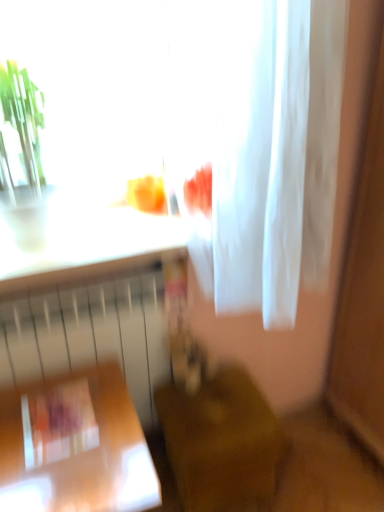
Question: Is white sheer fabric at upper center located within white matte radiator at lower left?

Choices:
 (A) yes
 (B) no

Answer: (B)

Question: Is white matte radiator at lower left shorter than white sheer fabric at upper center?

Choices:
 (A) no
 (B) yes

Answer: (A)

Question: Is white matte radiator at lower left at the left side of white sheer fabric at upper center?

Choices:
 (A) no
 (B) yes

Answer: (B)

Question: Is the depth of white matte radiator at lower left less than that of white sheer fabric at upper center?

Choices:
 (A) no
 (B) yes

Answer: (A)

Question: Is white matte radiator at lower left oriented away from white sheer fabric at upper center?

Choices:
 (A) no
 (B) yes

Answer: (A)

Question: Does white matte radiator at lower left have a greater height compared to white sheer fabric at upper center?

Choices:
 (A) no
 (B) yes

Answer: (B)

Question: Could you tell me if wooden chair at lower center, which is counted as the 1th furniture, starting from the right, is facing wooden table at lower left, the second furniture viewed from the right?

Choices:
 (A) yes
 (B) no

Answer: (B)

Question: Is wooden chair at lower center, which is the 2th furniture from left to right, not close to wooden table at lower left, positioned as the first furniture in left-to-right order?

Choices:
 (A) yes
 (B) no

Answer: (B)

Question: From the image's perspective, is wooden chair at lower center, which is the 2th furniture from left to right, on top of wooden table at lower left, positioned as the first furniture in left-to-right order?

Choices:
 (A) no
 (B) yes

Answer: (B)

Question: Considering the relative sizes of wooden chair at lower center, which is the 2th furniture from left to right, and wooden table at lower left, the second furniture viewed from the right, in the image provided, is wooden chair at lower center, which is the 2th furniture from left to right, shorter than wooden table at lower left, the second furniture viewed from the right,?

Choices:
 (A) yes
 (B) no

Answer: (A)

Question: Does wooden chair at lower center, which is the 2th furniture from left to right, have a larger size compared to wooden table at lower left, the second furniture viewed from the right?

Choices:
 (A) no
 (B) yes

Answer: (A)

Question: Is wooden chair at lower center, which is the 2th furniture from left to right, at the left side of wooden table at lower left, positioned as the first furniture in left-to-right order?

Choices:
 (A) yes
 (B) no

Answer: (B)

Question: Is white sheer fabric at upper center positioned beyond the bounds of white matte radiator at lower left?

Choices:
 (A) yes
 (B) no

Answer: (A)